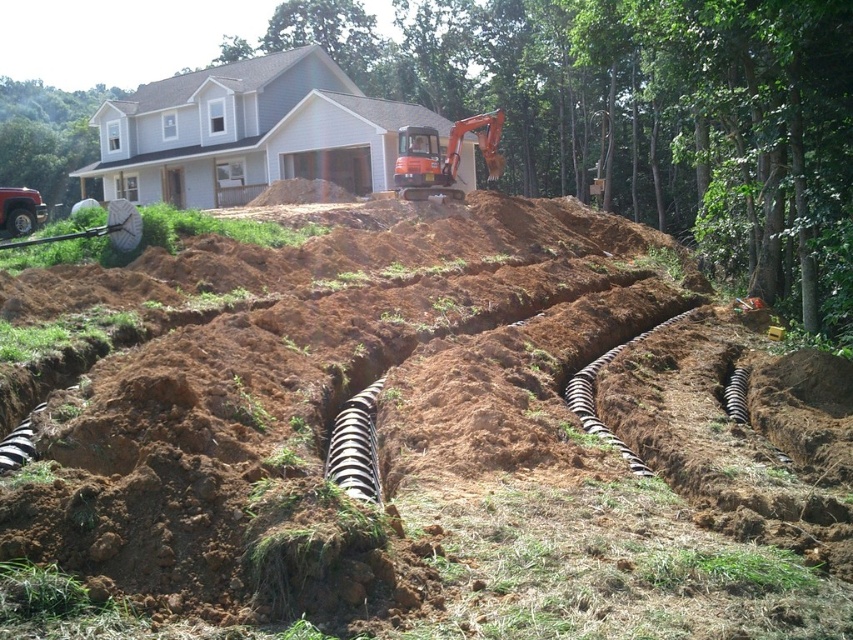
Question: Based on their relative distances, which object is nearer to the black rubber pipe at center?

Choices:
 (A) brown soil at center
 (B) orange rubber excavator at center
 (C) brown corrugated pipe at center
 (D) black striped pipe at center

Answer: (D)

Question: Which object is positioned closest to the brown soil at center?

Choices:
 (A) brown corrugated pipe at center
 (B) orange rubber excavator at center
 (C) black rubber pipe at center
 (D) black striped pipe at center

Answer: (C)

Question: Is orange rubber excavator at center thinner than brown corrugated pipe at center?

Choices:
 (A) no
 (B) yes

Answer: (A)

Question: Where is brown soil at center located in relation to brown corrugated pipe at center in the image?

Choices:
 (A) left
 (B) right

Answer: (B)

Question: Among these objects, which one is farthest from the camera?

Choices:
 (A) black rubber pipe at center
 (B) brown corrugated pipe at center
 (C) black striped pipe at center
 (D) brown soil at center

Answer: (C)

Question: Does orange rubber excavator at center appear under black rubber pipe at center?

Choices:
 (A) yes
 (B) no

Answer: (B)